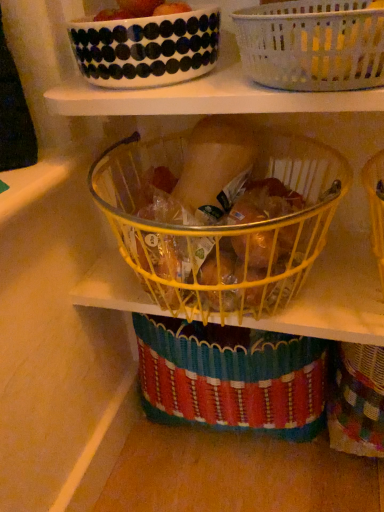
Question: Which direction should I rotate to look at yellow wire basket at center, which ranks as the second basket in top-to-bottom order, — up or down?

Choices:
 (A) up
 (B) down

Answer: (A)

Question: Does yellow wire basket at center, the first basket positioned from the bottom, come behind white woven basket at upper center, which is the 2th basket in bottom-to-top order?

Choices:
 (A) yes
 (B) no

Answer: (A)

Question: Does yellow wire basket at center, which ranks as the second basket in top-to-bottom order, have a greater width compared to white woven basket at upper center, which appears as the 1th basket when viewed from the top?

Choices:
 (A) no
 (B) yes

Answer: (B)

Question: Is yellow wire basket at center, the first basket positioned from the bottom, taller than white woven basket at upper center, which appears as the 1th basket when viewed from the top?

Choices:
 (A) yes
 (B) no

Answer: (A)

Question: Is yellow wire basket at center, the first basket positioned from the bottom, oriented away from white woven basket at upper center, which is the 2th basket in bottom-to-top order?

Choices:
 (A) no
 (B) yes

Answer: (A)

Question: Is yellow wire basket at center, which ranks as the second basket in top-to-bottom order, in front of white woven basket at upper center, which appears as the 1th basket when viewed from the top?

Choices:
 (A) yes
 (B) no

Answer: (B)

Question: Is yellow wire basket at center, the first basket positioned from the bottom, bigger than white woven basket at upper center, which is the 2th basket in bottom-to-top order?

Choices:
 (A) yes
 (B) no

Answer: (A)

Question: Is white woven basket at upper center, which appears as the 1th basket when viewed from the top, not within white glossy bowl at upper center?

Choices:
 (A) no
 (B) yes

Answer: (B)

Question: From a real-world perspective, is white woven basket at upper center, which is the 2th basket in bottom-to-top order, beneath white glossy bowl at upper center?

Choices:
 (A) no
 (B) yes

Answer: (B)

Question: Is white woven basket at upper center, which is the 2th basket in bottom-to-top order, positioned behind white glossy bowl at upper center?

Choices:
 (A) no
 (B) yes

Answer: (A)

Question: Is white glossy bowl at upper center at the back of white woven basket at upper center, which appears as the 1th basket when viewed from the top?

Choices:
 (A) yes
 (B) no

Answer: (B)

Question: Considering the relative sizes of white woven basket at upper center, which appears as the 1th basket when viewed from the top, and white glossy bowl at upper center in the image provided, is white woven basket at upper center, which appears as the 1th basket when viewed from the top, shorter than white glossy bowl at upper center?

Choices:
 (A) yes
 (B) no

Answer: (B)

Question: Is white woven basket at upper center, which is the 2th basket in bottom-to-top order, facing towards white glossy bowl at upper center?

Choices:
 (A) no
 (B) yes

Answer: (A)

Question: From the image's perspective, is yellow wire basket at center, the first basket positioned from the bottom, below smooth red tomato at upper center?

Choices:
 (A) no
 (B) yes

Answer: (B)